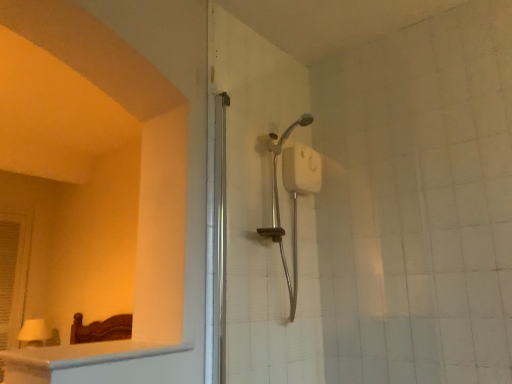
What is the approximate height of white plastic window at left?

white plastic window at left is 1.50 meters in height.

Describe the element at coordinates (13, 272) in the screenshot. This screenshot has height=384, width=512. I see `white plastic window at left` at that location.

At what (x,y) coordinates should I click in order to perform the action: click on white plastic window at left. Please return your answer as a coordinate pair (x, y). This screenshot has height=384, width=512. Looking at the image, I should click on (13, 272).

Identify the location of white plastic window at left. (13, 272).